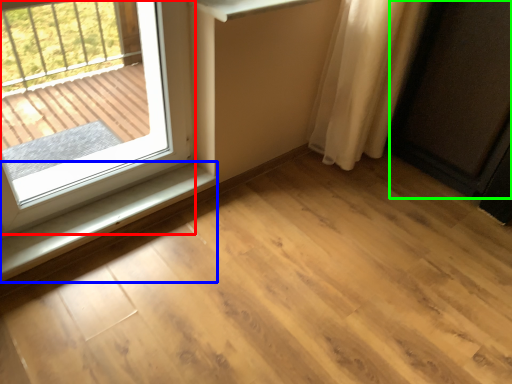
Question: Estimate the real-world distances between objects in this image. Which object is farther from window (highlighted by a red box), window sill (highlighted by a blue box) or screen door (highlighted by a green box)?

Choices:
 (A) window sill
 (B) screen door

Answer: (B)